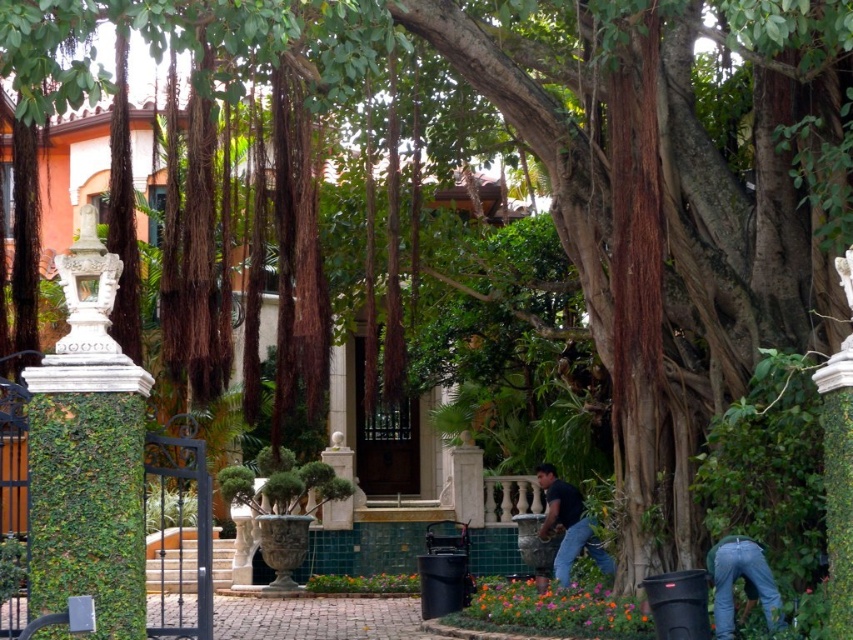
You are standing in the garden and want to place a new decorative stone at the exact location where the denim jeans at lower right are currently positioned. According to the scene, where should you place the stone?

The denim jeans at lower right are located at point (743, 582), so you should place the decorative stone at those coordinates.